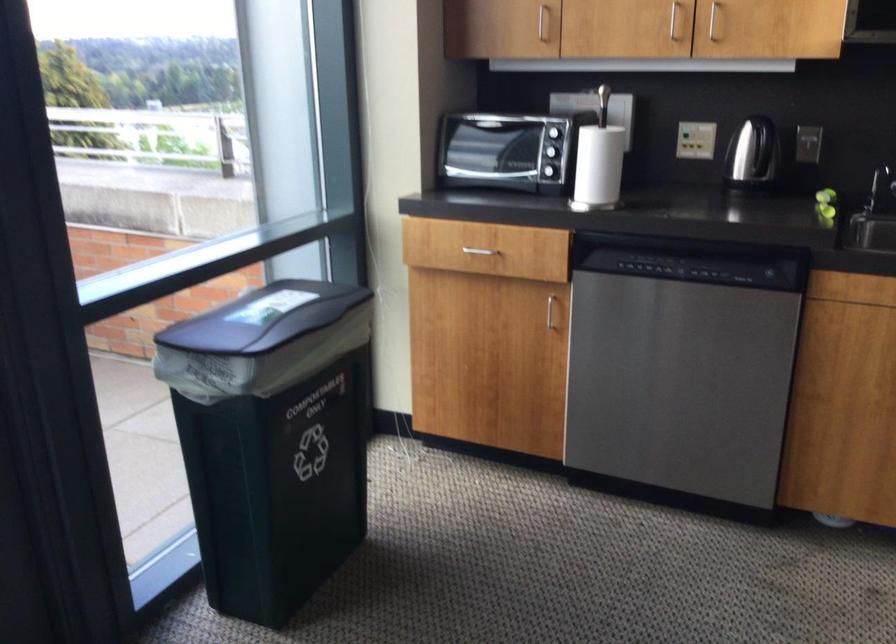
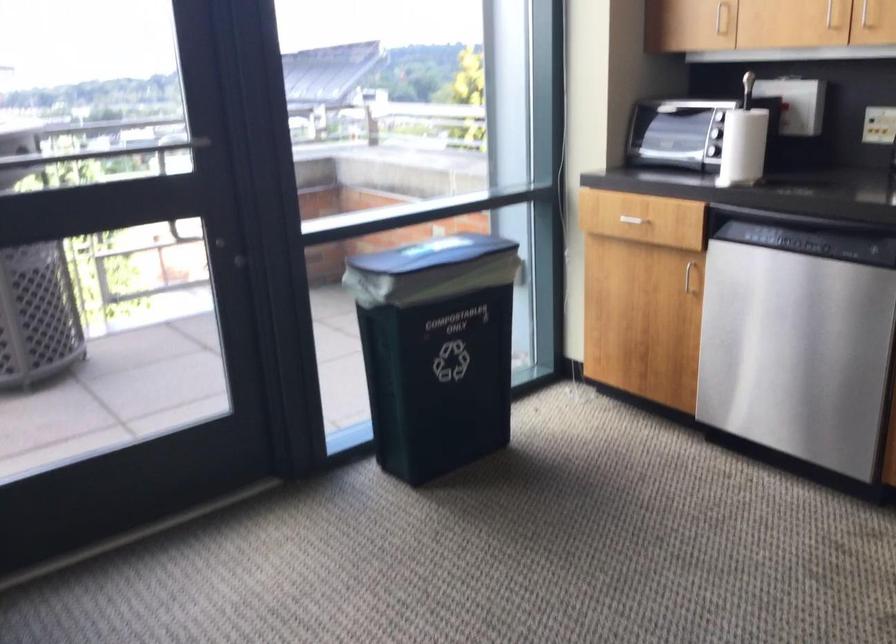
Question: The camera is either moving clockwise (left) or counter-clockwise (right) around the object. The first image is from the beginning of the video and the second image is from the end. Is the camera moving left or right when shooting the video?

Choices:
 (A) Left
 (B) Right

Answer: (B)